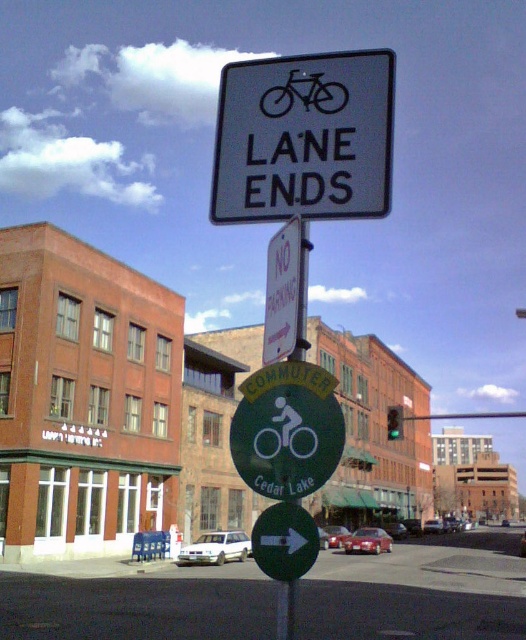
You are standing on the sidewalk and want to determine which of the two points, point (x=307, y=605) or point (x=288, y=97), is closer to you. Based on the image, which point is nearer?

Point (x=307, y=605) is further to the viewer than point (x=288, y=97), so the closer point is point (x=288, y=97).